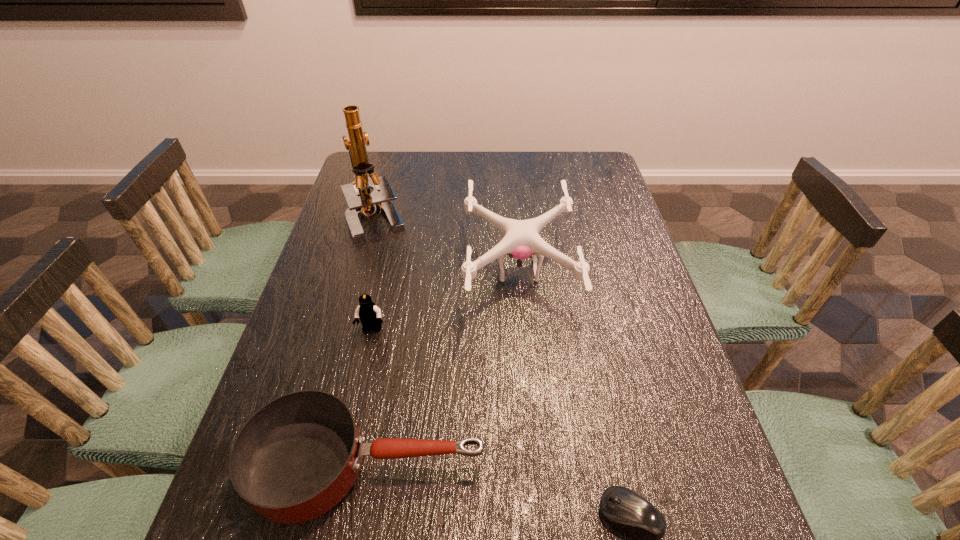
Image resolution: width=960 pixels, height=540 pixels. I want to click on unoccupied area between the second tallest object and the tallest object, so click(x=447, y=245).

Identify the location of empty space that is in between the Lego and the pan. (370, 397).

The width and height of the screenshot is (960, 540). In order to click on blank region between the third tallest object and the second shortest object in this screenshot , I will do `click(370, 397)`.

Find the location of a particular element. The height and width of the screenshot is (540, 960). vacant space that is in between the Lego and the pan is located at coordinates tap(370, 397).

The height and width of the screenshot is (540, 960). In order to click on free area in between the tallest object and the second shortest object in this screenshot , I will do tap(372, 342).

At what (x,y) coordinates should I click in order to perform the action: click on free space that is in between the drone and the Lego. Please return your answer as a coordinate pair (x, y). The width and height of the screenshot is (960, 540). Looking at the image, I should click on [x=445, y=300].

Locate an element on the screen. The width and height of the screenshot is (960, 540). object that is the closest one to the mouse is located at coordinates (297, 457).

At what (x,y) coordinates should I click in order to perform the action: click on object that is the fourth closest one to the shortest object. Please return your answer as a coordinate pair (x, y). The height and width of the screenshot is (540, 960). Looking at the image, I should click on (361, 201).